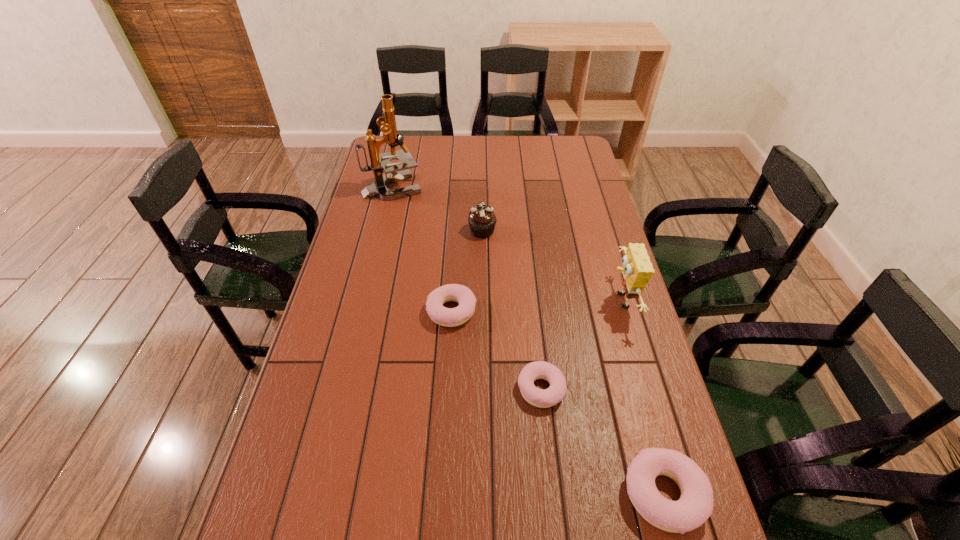
Locate an element on the screen. vacant space that satisfies the following two spatial constraints: 1. at the eyepiece of the leftmost object; 2. on the back side of the farthest doughnut is located at coordinates (363, 311).

I want to click on vacant space that satisfies the following two spatial constraints: 1. on the back side of the leftmost doughnut; 2. at the eyepiece of the microscope, so click(x=459, y=187).

This screenshot has height=540, width=960. Identify the location of vacant space that satisfies the following two spatial constraints: 1. on the front side of the nearest doughnut; 2. on the right side of the leftmost doughnut. (442, 494).